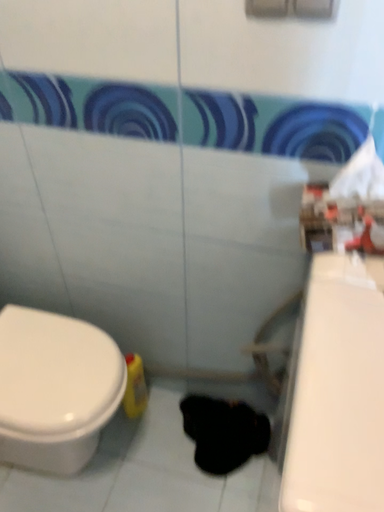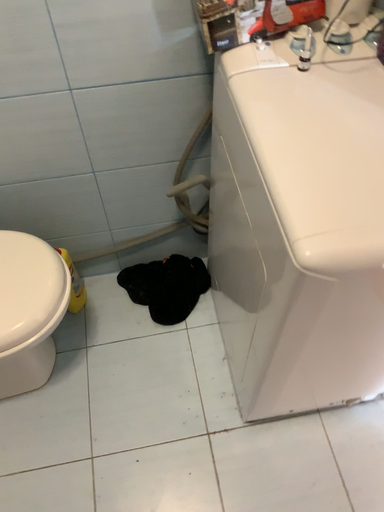
Question: How did the camera likely rotate when shooting the video?

Choices:
 (A) rotated upward
 (B) rotated downward

Answer: (B)